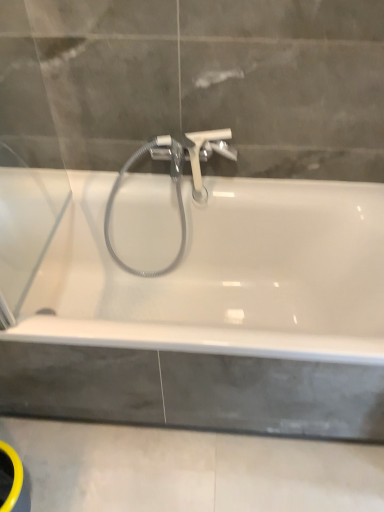
Question: Is white plastic tap at center spatially inside concreteroughbath edge at lower center, or outside of it?

Choices:
 (A) inside
 (B) outside

Answer: (B)

Question: From a real-world perspective, is white plastic tap at center physically located above or below concreteroughbath edge at lower center?

Choices:
 (A) above
 (B) below

Answer: (A)

Question: Estimate the real-world distances between objects in this image. Which object is closer to the white glossy bathtub at center?

Choices:
 (A) white plastic tap at center
 (B) concreteroughbath edge at lower center

Answer: (B)

Question: Which is farther from the white plastic tap at center?

Choices:
 (A) concreteroughbath edge at lower center
 (B) white glossy bathtub at center

Answer: (A)